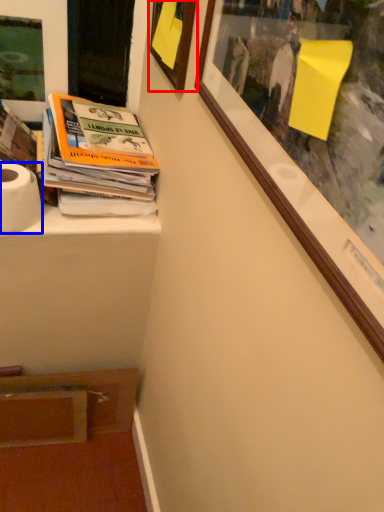
Question: Which object appears farthest to the camera in this image, picture frame (highlighted by a red box) or toilet paper (highlighted by a blue box)?

Choices:
 (A) picture frame
 (B) toilet paper

Answer: (B)